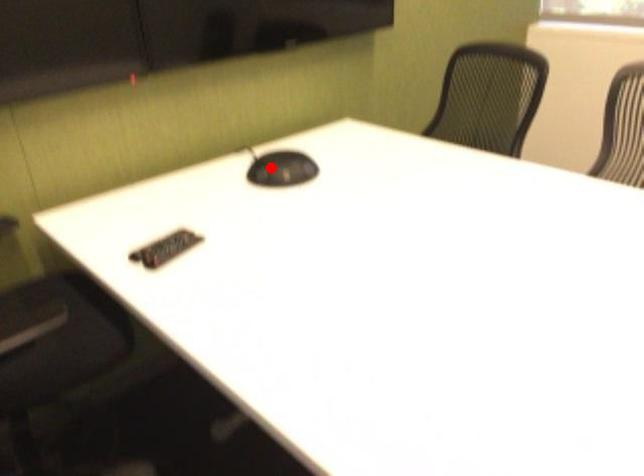
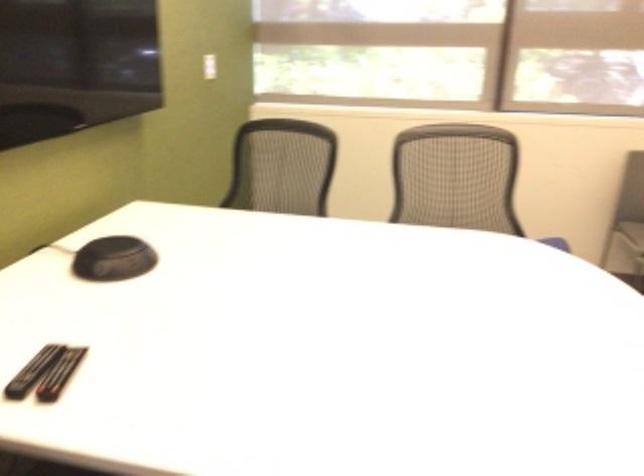
Where in the second image is the point corresponding to the highlighted location from the first image?

(113, 259)